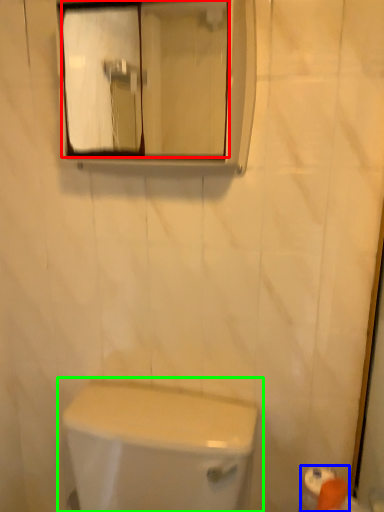
Question: Considering the real-world distances, which object is closest to mirror (highlighted by a red box)? toilet paper (highlighted by a blue box) or toilet (highlighted by a green box).

Choices:
 (A) toilet paper
 (B) toilet

Answer: (B)